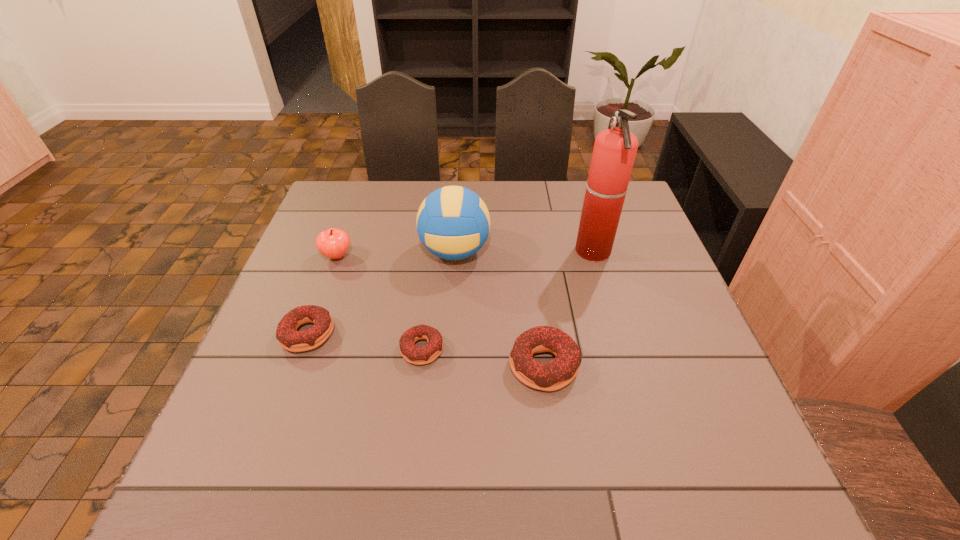
Find the location of a particular element. object at the right edge is located at coordinates (614, 152).

Where is `vacant space at the far edge of the desktop`? The width and height of the screenshot is (960, 540). vacant space at the far edge of the desktop is located at coordinates (576, 188).

Identify the location of vacant space at the near edge of the desktop. This screenshot has height=540, width=960. (633, 435).

In the image, there is a desktop. Where is `free region at the left edge`? Image resolution: width=960 pixels, height=540 pixels. free region at the left edge is located at coordinates (276, 321).

Find the location of a particular element. This screenshot has height=540, width=960. vacant space at the far left corner of the desktop is located at coordinates (340, 215).

In the image, there is a desktop. Where is `vacant space at the near right corner`? vacant space at the near right corner is located at coordinates (726, 437).

This screenshot has height=540, width=960. Identify the location of free point between the fifth shortest object and the rightmost object. (524, 252).

The image size is (960, 540). I want to click on free point between the fifth tallest object and the second doughnut from right to left, so click(365, 342).

Where is `empty space that is in between the second shortest object and the volleyball`? Image resolution: width=960 pixels, height=540 pixels. empty space that is in between the second shortest object and the volleyball is located at coordinates (381, 293).

Image resolution: width=960 pixels, height=540 pixels. I want to click on free space between the shortest object and the tallest object, so click(x=508, y=300).